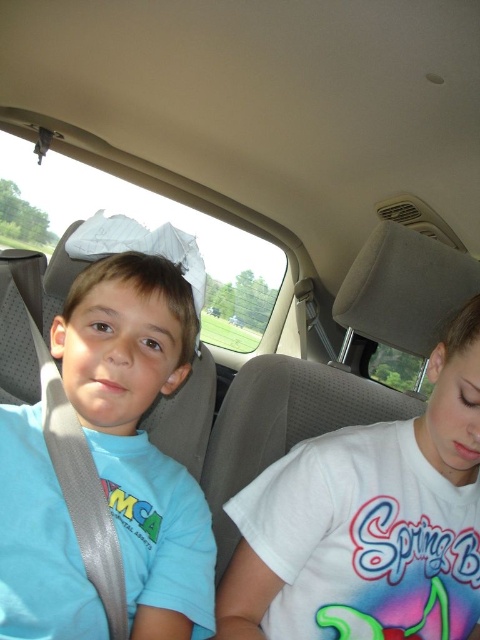
Question: Where is white cotton shirt at right located in relation to matte blue shirt at left in the image?

Choices:
 (A) right
 (B) left

Answer: (A)

Question: Is white cotton shirt at right closer to the viewer compared to matte blue shirt at left?

Choices:
 (A) yes
 (B) no

Answer: (B)

Question: Among these objects, which one is nearest to the camera?

Choices:
 (A) white cotton shirt at right
 (B) matte blue shirt at left

Answer: (B)

Question: Observing the image, what is the correct spatial positioning of white cotton shirt at right in reference to matte blue shirt at left?

Choices:
 (A) right
 (B) left

Answer: (A)

Question: Which point appears closest to the camera in this image?

Choices:
 (A) (91, 608)
 (B) (385, 524)

Answer: (A)